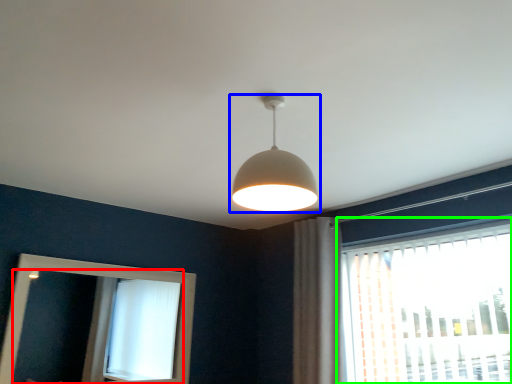
Question: Based on their relative distances, which object is farther from mirror (highlighted by a red box)? Choose from lamp (highlighted by a blue box) and window (highlighted by a green box).

Choices:
 (A) lamp
 (B) window

Answer: (A)